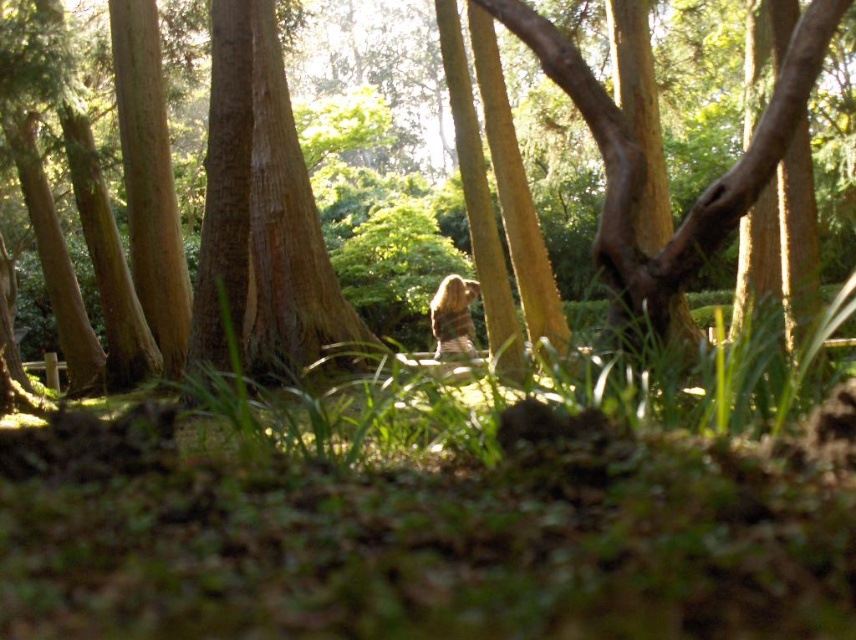
Question: Is brown textured tree trunk at center thinner than brown furry bear at center?

Choices:
 (A) no
 (B) yes

Answer: (A)

Question: Is brown textured tree trunk at center closer to the viewer compared to brown furry bear at center?

Choices:
 (A) yes
 (B) no

Answer: (A)

Question: Which object is the farthest from the brown furry bear at center?

Choices:
 (A) brown textured tree trunk at center
 (B) smooth brown tree trunk at center

Answer: (B)

Question: Which object is closer to the camera taking this photo?

Choices:
 (A) brown textured tree trunk at center
 (B) brown furry bear at center
 (C) green grass at center
 (D) smooth brown tree trunk at center

Answer: (C)

Question: Among these points, which one is farthest from the camera?

Choices:
 (A) (621, 250)
 (B) (462, 317)
 (C) (200, 273)
 (D) (853, 627)

Answer: (B)

Question: Can you confirm if smooth brown tree trunk at center is smaller than brown furry bear at center?

Choices:
 (A) yes
 (B) no

Answer: (A)